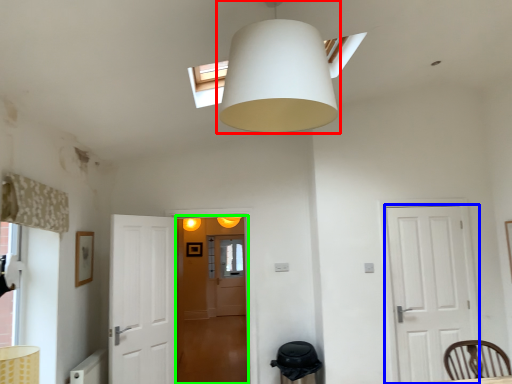
Question: Which object is positioned closest to lamp (highlighted by a red box)? Select from door (highlighted by a blue box) and glass door (highlighted by a green box).

Choices:
 (A) door
 (B) glass door

Answer: (A)